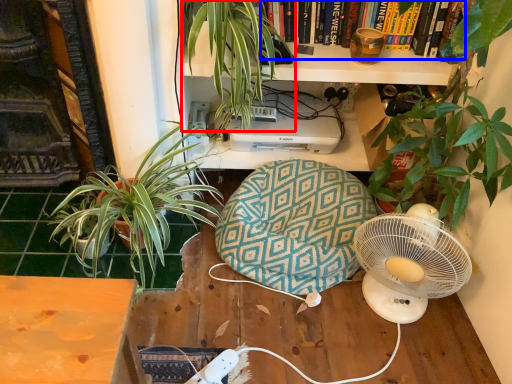
Question: Which object is closer to the camera taking this photo, houseplant (highlighted by a red box) or book (highlighted by a blue box)?

Choices:
 (A) houseplant
 (B) book

Answer: (A)